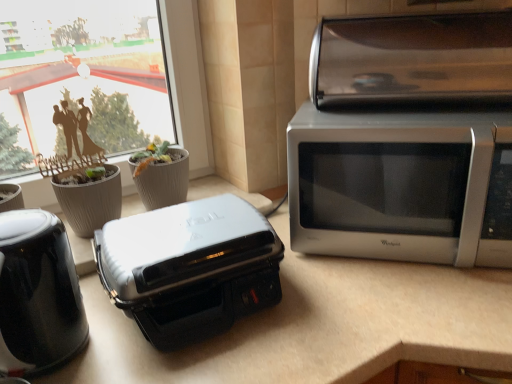
Question: Is white glossy countertop at center spatially inside satin silver microwave at right, or outside of it?

Choices:
 (A) inside
 (B) outside

Answer: (B)

Question: Would you say white glossy countertop at center is to the left or to the right of satin silver microwave at right in the picture?

Choices:
 (A) right
 (B) left

Answer: (B)

Question: Which is nearer to the gray textured flowerpot at left, which is the first flowerpot from left to right?

Choices:
 (A) white glossy countertop at center
 (B) satin silver toaster oven at upper right
 (C) black glossy kettle at left
 (D) white plastic toaster at center
 (E) gray textured flowerpot at center, which is the first flowerpot in right-to-left order

Answer: (E)

Question: Which is farther from the satin silver microwave at right?

Choices:
 (A) gray textured flowerpot at left, which is the first flowerpot from left to right
 (B) white glossy countertop at center
 (C) gray textured flowerpot at center, placed as the 2th flowerpot when sorted from left to right
 (D) black glossy kettle at left
 (E) white plastic toaster at center

Answer: (A)